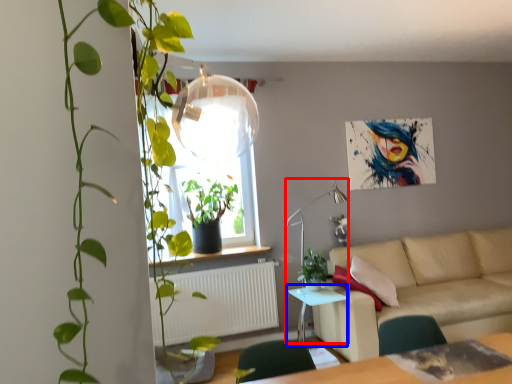
Question: Among these objects, which one is farthest to the camera, lamp (highlighted by a red box) or table (highlighted by a blue box)?

Choices:
 (A) lamp
 (B) table

Answer: (A)